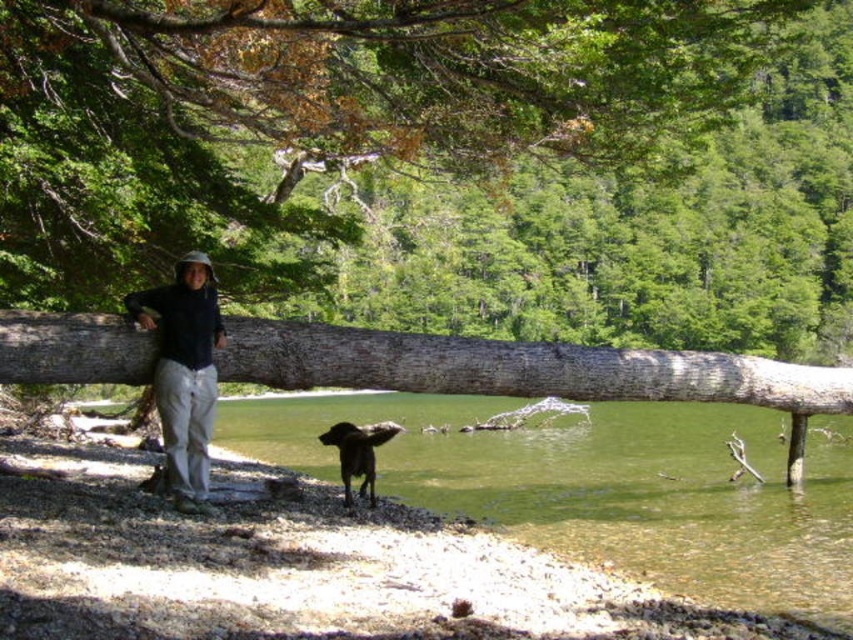
Is point (799, 371) farther from camera compared to point (180, 376)?

Yes.

Is gray rough wood log at center positioned in front of black matte jacket at center?

No, gray rough wood log at center is behind black matte jacket at center.

Does point (352, 376) lie behind point (140, 298)?

Yes, point (352, 376) is farther from viewer.

At what (x,y) coordinates should I click in order to perform the action: click on gray rough wood log at center. Please return your answer as a coordinate pair (x, y). Looking at the image, I should click on (517, 368).

In the scene shown: Does smooth brown log at center have a smaller size compared to black matte jacket at center?

No, smooth brown log at center is not smaller than black matte jacket at center.

Who is taller, smooth brown log at center or black matte jacket at center?

smooth brown log at center is taller.

Find the location of a particular element. The width and height of the screenshot is (853, 640). smooth brown log at center is located at coordinates (444, 164).

Which is behind, point (149, 320) or point (347, 456)?

Point (347, 456)

Can you confirm if black matte jacket at center is thinner than shiny brown fur at lower center?

Yes.

You are a GUI agent. You are given a task and a screenshot of the screen. Output one action in this format:
    pyautogui.click(x=<x>, y=<y>)
    Task: Click on the black matte jacket at center
    This screenshot has height=640, width=853.
    Given the screenshot: What is the action you would take?
    pyautogui.click(x=183, y=372)